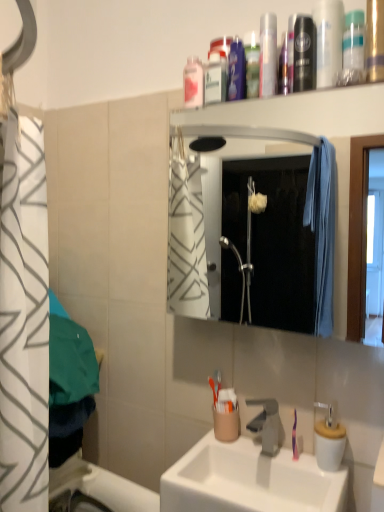
Identify the location of vacant area to the right of satin nickel faucet at sink center. (302, 464).